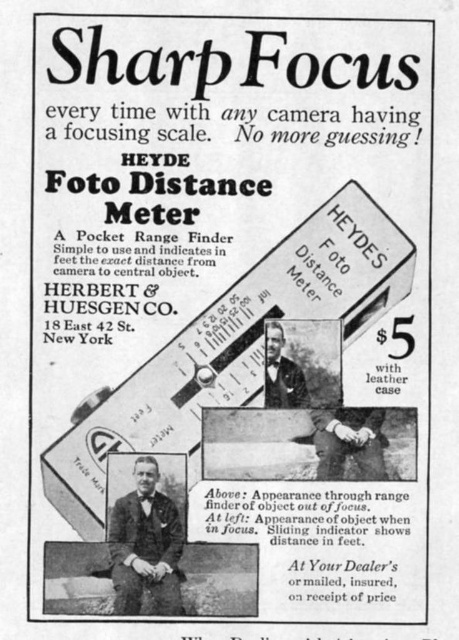
You are a photographer in the 1920s preparing to take a photo. You notice both the light brown leather gloves at center and the black leather jacket at center in the advertisement. Which item appears smaller in the image?

The light brown leather gloves at center appears smaller than the black leather jacket at center in the advertisement.

You are a photographer in the early 20th century, and you are looking at this advertisement. You notice the black suit at center and the light brown leather gloves at center. Which object is closer to you in the image?

The black suit at center is closer to you because it is in front of the light brown leather gloves at center.

You are a photographer from the 1920s looking at this advertisement. You notice the black suit at center and the light brown leather gloves at center. Which object is located more to the left?

The black suit at center is positioned on the left side of light brown leather gloves at center, so the black suit at center is more to the left.